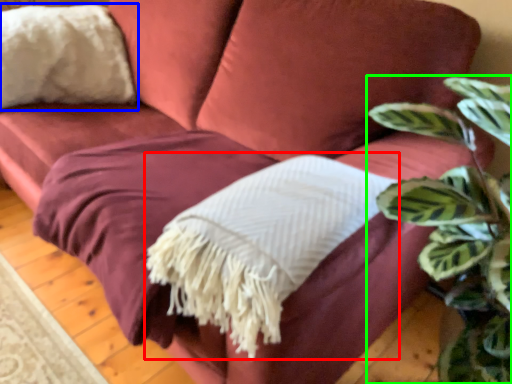
Question: Considering the real-world distances, which object is closest to blanket (highlighted by a red box)? throw pillow (highlighted by a blue box) or houseplant (highlighted by a green box).

Choices:
 (A) throw pillow
 (B) houseplant

Answer: (B)